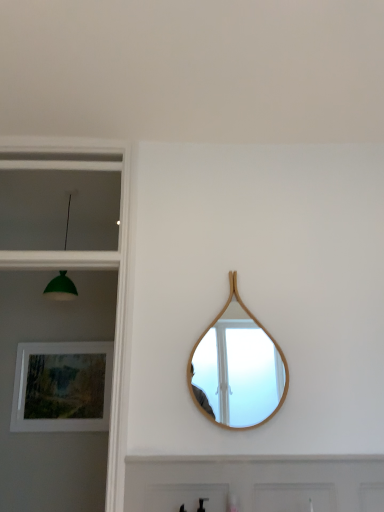
Identify the location of matte glass window at upper left. Image resolution: width=384 pixels, height=512 pixels. (60, 201).

This screenshot has height=512, width=384. Describe the element at coordinates (62, 387) in the screenshot. I see `matte wooden picture frame at lower left` at that location.

Image resolution: width=384 pixels, height=512 pixels. Find the location of `green matte lampshade at left`. green matte lampshade at left is located at coordinates (61, 288).

This screenshot has height=512, width=384. What do you see at coordinates (254, 484) in the screenshot?
I see `white painted wood door at lower center` at bounding box center [254, 484].

The height and width of the screenshot is (512, 384). I want to click on matte glass window at upper left, so click(60, 201).

The height and width of the screenshot is (512, 384). Identify the location of door on the right of matte wooden picture frame at lower left. [x=254, y=484].

Is matte wooden picture frame at lower left at the right side of white painted wood door at lower center?

No, matte wooden picture frame at lower left is not to the right of white painted wood door at lower center.

Is matte wooden picture frame at lower left in front of white painted wood door at lower center?

No, it is not.

Which of these two, matte wooden picture frame at lower left or white painted wood door at lower center, stands shorter?

Standing shorter between the two is white painted wood door at lower center.

Can you confirm if matte wooden picture frame at lower left is smaller than wooden mirror at center?

Actually, matte wooden picture frame at lower left might be larger than wooden mirror at center.

Could wooden mirror at center be considered to be inside matte wooden picture frame at lower left?

No, wooden mirror at center is not inside matte wooden picture frame at lower left.

Does matte wooden picture frame at lower left turn towards wooden mirror at center?

No, matte wooden picture frame at lower left is not turned towards wooden mirror at center.

From the image's perspective, is matte wooden picture frame at lower left over wooden mirror at center?

No.

From a real-world perspective, is white painted wood door at lower center below green matte lampshade at left?

Correct, in the physical world, white painted wood door at lower center is lower than green matte lampshade at left.

There is a white painted wood door at lower center. At what (x,y) coordinates should I click in order to perform the action: click on light fixture above it (from a real-world perspective). Please return your answer as a coordinate pair (x, y). The width and height of the screenshot is (384, 512). Looking at the image, I should click on (61, 288).

Measure the distance between white painted wood door at lower center and green matte lampshade at left.

white painted wood door at lower center is 4.91 feet from green matte lampshade at left.

Would you say white painted wood door at lower center is outside green matte lampshade at left?

white painted wood door at lower center lies outside green matte lampshade at left's area.

Considering the points (241, 319) and (98, 215), which point is behind, point (241, 319) or point (98, 215)?

The point (98, 215) is behind.

Locate an element on the screen. Image resolution: width=384 pixels, height=512 pixels. window that appears on the left of wooden mirror at center is located at coordinates (60, 201).

From a real-world perspective, is wooden mirror at center above or below matte glass window at upper left?

In terms of real-world spatial position, wooden mirror at center is below matte glass window at upper left.

Which is in front, point (205, 367) or point (46, 366)?

Positioned in front is point (205, 367).

From the image's perspective, is wooden mirror at center above matte wooden picture frame at lower left?

Yes, from the image's perspective, wooden mirror at center is on top of matte wooden picture frame at lower left.

In the image, is wooden mirror at center positioned in front of or behind matte wooden picture frame at lower left?

Visually, wooden mirror at center is located in front of matte wooden picture frame at lower left.

Is wooden mirror at center thinner than matte wooden picture frame at lower left?

Yes, wooden mirror at center is thinner than matte wooden picture frame at lower left.

In the scene shown: Between matte wooden picture frame at lower left and green matte lampshade at left, which one has less height?

matte wooden picture frame at lower left is shorter.

Considering the relative sizes of matte wooden picture frame at lower left and green matte lampshade at left in the image provided, is matte wooden picture frame at lower left bigger than green matte lampshade at left?

Incorrect, matte wooden picture frame at lower left is not larger than green matte lampshade at left.

From the image's perspective, which one is positioned lower, matte wooden picture frame at lower left or green matte lampshade at left?

matte wooden picture frame at lower left, from the image's perspective.

Is matte wooden picture frame at lower left facing away from green matte lampshade at left?

No, matte wooden picture frame at lower left is not facing away from green matte lampshade at left.

Is point (15, 170) more distant than point (298, 472)?

Yes, point (15, 170) is behind point (298, 472).

Looking at this image, would you say matte glass window at upper left is inside or outside white painted wood door at lower center?

matte glass window at upper left is not inside white painted wood door at lower center, it's outside.

Considering the positions of objects matte glass window at upper left and white painted wood door at lower center in the image provided, who is behind, matte glass window at upper left or white painted wood door at lower center?

matte glass window at upper left.

Where is `door on the right of matte wooden picture frame at lower left`? The width and height of the screenshot is (384, 512). door on the right of matte wooden picture frame at lower left is located at coordinates (254, 484).

In order to click on picture frame below the wooden mirror at center (from a real-world perspective) in this screenshot , I will do `click(62, 387)`.

Estimate the real-world distances between objects in this image. Which object is closer to matte glass window at upper left, green matte lampshade at left or wooden mirror at center?

The object closer to matte glass window at upper left is green matte lampshade at left.

Which object lies nearer to the anchor point wooden mirror at center, matte glass window at upper left or white painted wood door at lower center?

The object closer to wooden mirror at center is white painted wood door at lower center.

Estimate the real-world distances between objects in this image. Which object is closer to matte glass window at upper left, white painted wood door at lower center or matte wooden picture frame at lower left?

Among the two, matte wooden picture frame at lower left is located nearer to matte glass window at upper left.

Consider the image. Based on their spatial positions, is wooden mirror at center or matte glass window at upper left closer to white painted wood door at lower center?

Among the two, wooden mirror at center is located nearer to white painted wood door at lower center.

Looking at the image, which one is located further to matte wooden picture frame at lower left, green matte lampshade at left or wooden mirror at center?

wooden mirror at center is positioned further to the anchor matte wooden picture frame at lower left.

Based on the photo, from the image, which object appears to be farther from wooden mirror at center, green matte lampshade at left or matte glass window at upper left?

Based on the image, matte glass window at upper left appears to be further to wooden mirror at center.

Which object lies nearer to the anchor point green matte lampshade at left, white painted wood door at lower center or wooden mirror at center?

Based on the image, wooden mirror at center appears to be nearer to green matte lampshade at left.

Considering their positions, is matte glass window at upper left positioned closer to white painted wood door at lower center than green matte lampshade at left?

The object closer to white painted wood door at lower center is green matte lampshade at left.

You are a GUI agent. You are given a task and a screenshot of the screen. Output one action in this format:
    pyautogui.click(x=<x>, y=<y>)
    Task: Click on the window between green matte lampshade at left and wooden mirror at center in the horizontal direction
    The image size is (384, 512).
    Given the screenshot: What is the action you would take?
    pyautogui.click(x=60, y=201)

Where is `mirror located between matte wooden picture frame at lower left and white painted wood door at lower center in the left-right direction`? The image size is (384, 512). mirror located between matte wooden picture frame at lower left and white painted wood door at lower center in the left-right direction is located at coordinates (237, 370).

Find the location of a particular element. The image size is (384, 512). mirror between matte glass window at upper left and matte wooden picture frame at lower left in the vertical direction is located at coordinates (237, 370).

Where is `picture frame between green matte lampshade at left and white painted wood door at lower center`? The image size is (384, 512). picture frame between green matte lampshade at left and white painted wood door at lower center is located at coordinates (62, 387).